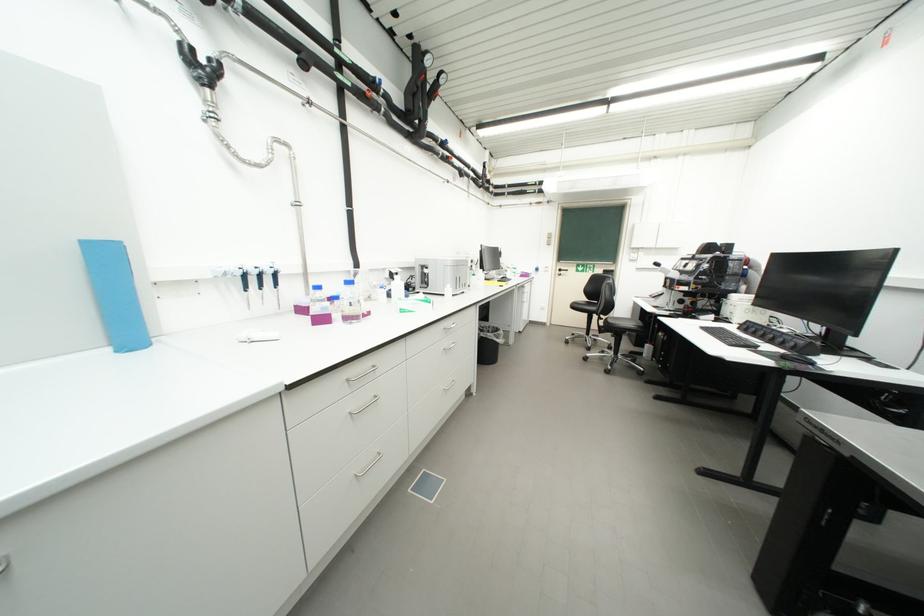
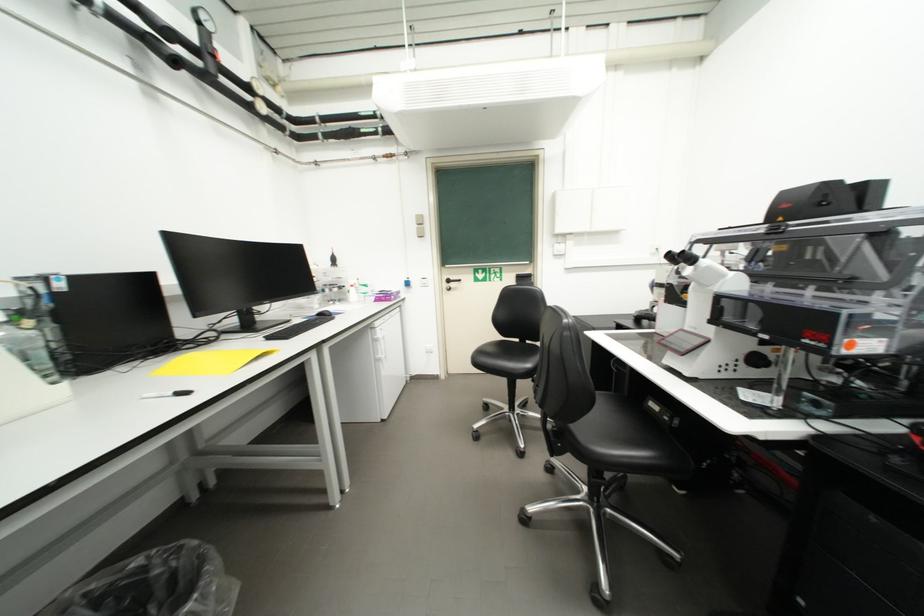
Find the pixel in the second image that matches the point at 567,272 in the first image.

(456, 283)